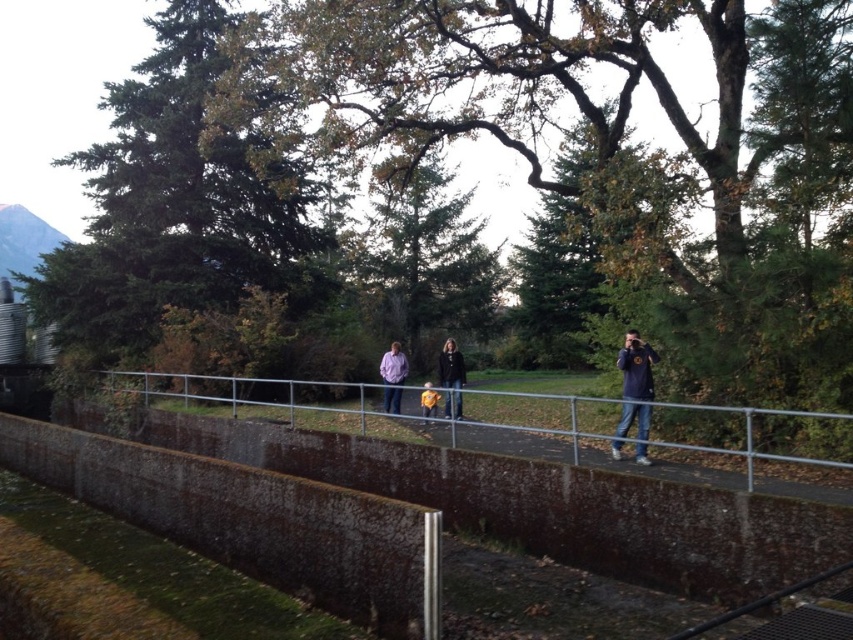
Question: Which point is farther to the camera?

Choices:
 (A) (370, 404)
 (B) (398, 355)

Answer: (A)

Question: Based on their relative distances, which object is farther from the pink shirt at center?

Choices:
 (A) metal/rusty fence at center
 (B) dark blue shirt at right

Answer: (B)

Question: Is metal/rusty fence at center wider than black leather jacket at center?

Choices:
 (A) no
 (B) yes

Answer: (B)

Question: Among these objects, which one is nearest to the camera?

Choices:
 (A) metal/rusty fence at center
 (B) black leather jacket at center

Answer: (A)

Question: Is metal/rusty fence at center closer to camera compared to dark blue shirt at right?

Choices:
 (A) yes
 (B) no

Answer: (A)

Question: Does black leather jacket at center have a larger size compared to yellow fabric at center?

Choices:
 (A) yes
 (B) no

Answer: (B)